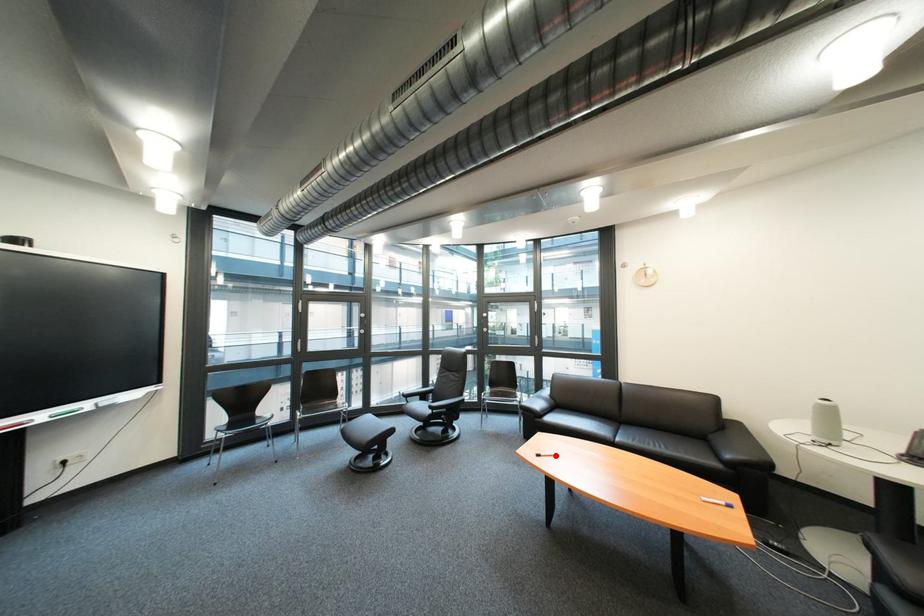
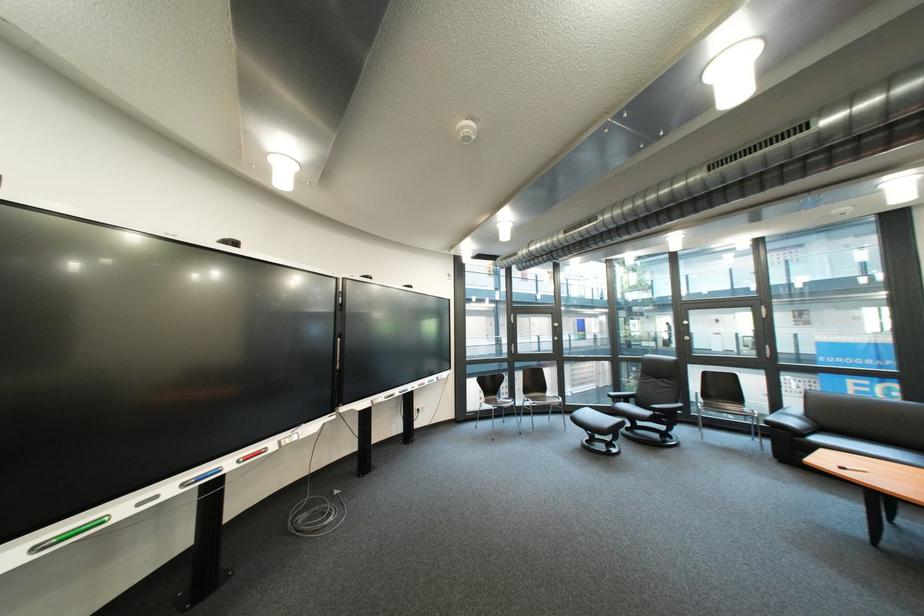
Locate, in the second image, the point that corresponds to the highlighted location in the first image.

(862, 469)